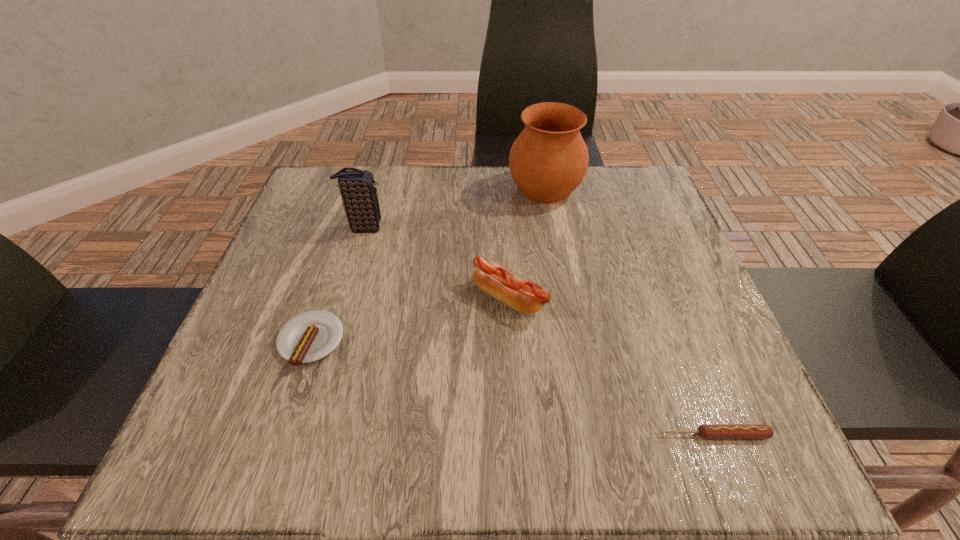
Where is `vacant space located 0.220m on the front of the tallest object`? The width and height of the screenshot is (960, 540). vacant space located 0.220m on the front of the tallest object is located at coordinates (561, 276).

Find the location of a particular element. vacant point located 0.210m with the zip open on the clutch bag is located at coordinates (475, 227).

The height and width of the screenshot is (540, 960). In order to click on vacant area situated 0.300m on the right of the tallest sausage in this screenshot , I will do `click(695, 298)`.

Identify the location of vacant region located 0.370m on the right of the second shortest sausage. This screenshot has width=960, height=540. (545, 341).

I want to click on vacant region located 0.380m on the left of the shortest object, so click(415, 435).

You are a GUI agent. You are given a task and a screenshot of the screen. Output one action in this format:
    pyautogui.click(x=<x>, y=<y>)
    Task: Click on the pottery that is at the far edge
    This screenshot has height=540, width=960.
    Given the screenshot: What is the action you would take?
    pyautogui.click(x=549, y=159)

Where is `clutch bag situated at the far edge`? clutch bag situated at the far edge is located at coordinates tap(357, 187).

This screenshot has height=540, width=960. I want to click on object located at the near edge, so click(707, 431).

At what (x,y) coordinates should I click in order to perform the action: click on clutch bag located at the left edge. Please return your answer as a coordinate pair (x, y). This screenshot has height=540, width=960. Looking at the image, I should click on (357, 187).

Find the location of a particular element. sausage that is at the left edge is located at coordinates (310, 336).